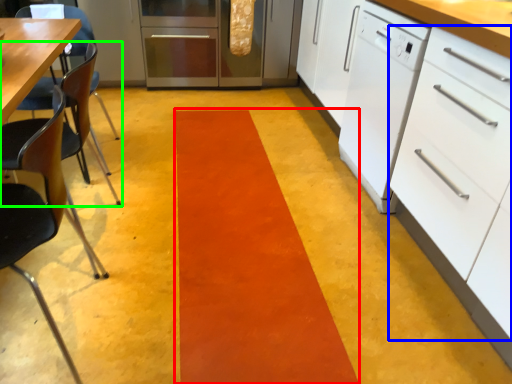
Question: Considering the real-world distances, which object is farthest from strip (highlighted by a red box)? drawer (highlighted by a blue box) or chair (highlighted by a green box)?

Choices:
 (A) drawer
 (B) chair

Answer: (B)